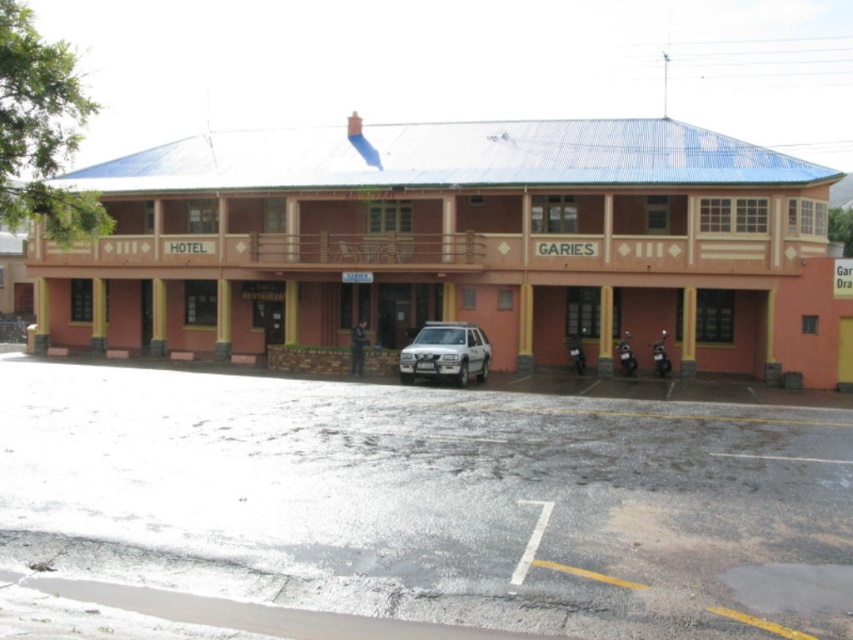
Question: Among these objects, which one is nearest to the camera?

Choices:
 (A) black matte motorcycle at lower right
 (B) white matte suv at center
 (C) matte black scooter at lower right

Answer: (B)

Question: Which point is closer to the camera?

Choices:
 (A) (628, 342)
 (B) (479, 380)
 (C) (732, 541)
 (D) (583, 352)

Answer: (C)

Question: Can you confirm if gray asphalt parking lot at center is positioned above white matte suv at center?

Choices:
 (A) yes
 (B) no

Answer: (B)

Question: Does gray asphalt parking lot at center lie behind matte black scooter at lower right?

Choices:
 (A) no
 (B) yes

Answer: (A)

Question: From the image, what is the correct spatial relationship of white matte suv at center in relation to matte black scooter at lower right?

Choices:
 (A) above
 (B) below

Answer: (A)

Question: Which object appears farthest from the camera in this image?

Choices:
 (A) metallic silver motorcycle at center
 (B) black matte motorcycle at lower right
 (C) white matte suv at center

Answer: (A)